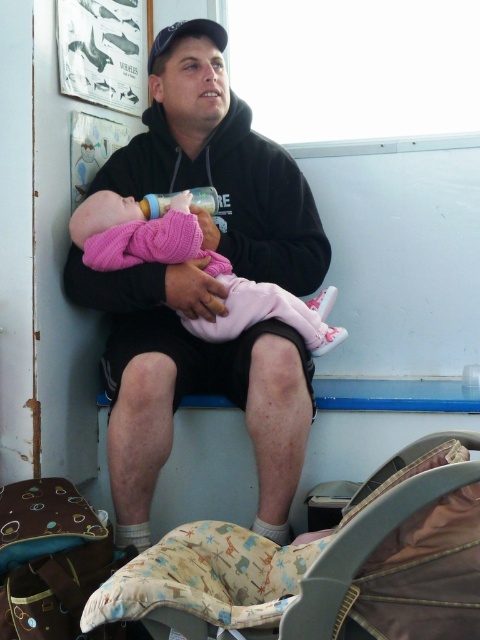
You are an interior designer analyzing the placement of objects in this indoor scene. Where exactly is the black hoodie at center located in terms of coordinates?

The black hoodie at center is located at coordinates point [206,285].

From the picture: You are designing a new clothing line and want to create a matching set for the black hoodie at center and the pink knitted baby at center. Considering their sizes, which garment should you adjust to ensure they are proportionally balanced?

The black hoodie at center is wider than the pink knitted baby at center, so you should adjust the pink knitted baby at center to be wider to match the proportions of the black hoodie at center.